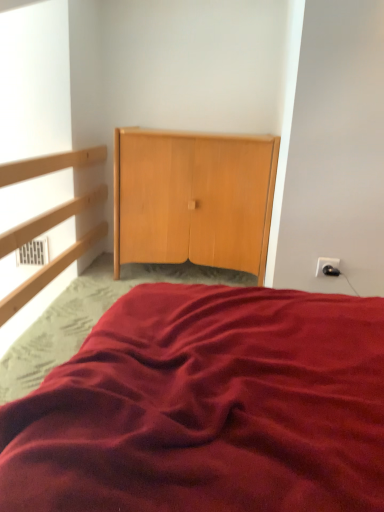
Find the location of a particular element. The image size is (384, 512). black plastic outlet at upper right is located at coordinates (327, 267).

Is burgundy satin bed at center in front of or behind black plastic outlet at upper right in the image?

Clearly, burgundy satin bed at center is in front of black plastic outlet at upper right.

Does point (147, 381) appear closer or farther from the camera than point (330, 260)?

Point (147, 381).

Is burgundy satin bed at center situated inside black plastic outlet at upper right or outside?

burgundy satin bed at center is outside black plastic outlet at upper right.

Considering the sizes of objects black plastic outlet at upper right and light wood dresser at center in the image provided, who is bigger, black plastic outlet at upper right or light wood dresser at center?

Bigger between the two is light wood dresser at center.

Is the depth of black plastic outlet at upper right less than that of light wood dresser at center?

Yes, it is.

Image resolution: width=384 pixels, height=512 pixels. In order to click on electric outlet lying below the light wood dresser at center (from the image's perspective) in this screenshot , I will do (327, 267).

Considering the positions of points (226, 140) and (328, 269), is point (226, 140) closer to camera compared to point (328, 269)?

No.

Is light wood dresser at center aimed at black plastic outlet at upper right?

No, light wood dresser at center is not oriented towards black plastic outlet at upper right.

From a real-world perspective, is light wood dresser at center physically below black plastic outlet at upper right?

Actually, light wood dresser at center is physically above black plastic outlet at upper right in the real world.

Is light wood dresser at center to the right of burgundy satin bed at center from the viewer's perspective?

In fact, light wood dresser at center is to the left of burgundy satin bed at center.

From a real-world perspective, is light wood dresser at center located higher than burgundy satin bed at center?

Indeed, from a real-world perspective, light wood dresser at center stands above burgundy satin bed at center.

Considering the relative positions of light wood dresser at center and burgundy satin bed at center in the image provided, is light wood dresser at center behind burgundy satin bed at center?

Yes, it is behind burgundy satin bed at center.

From the image's perspective, which is below, light wood dresser at center or burgundy satin bed at center?

From the image's view, burgundy satin bed at center is below.

Is black plastic outlet at upper right turned away from burgundy satin bed at center?

No, burgundy satin bed at center is not at the back of black plastic outlet at upper right.

Considering the positions of point (322, 273) and point (305, 416), is point (322, 273) closer or farther from the camera than point (305, 416)?

Point (322, 273) is farther from the camera than point (305, 416).

Which of these two, black plastic outlet at upper right or burgundy satin bed at center, stands shorter?

black plastic outlet at upper right is shorter.

Does black plastic outlet at upper right lie in front of burgundy satin bed at center?

No, it is not.

Which is closer, [228,507] or [253,181]?

The point [228,507] is in front.

Considering the relative positions of burgundy satin bed at center and light wood dresser at center in the image provided, is burgundy satin bed at center behind light wood dresser at center?

No, it is in front of light wood dresser at center.

Could you tell me if burgundy satin bed at center is turned towards light wood dresser at center?

No, burgundy satin bed at center is not oriented towards light wood dresser at center.

Which object is wider, burgundy satin bed at center or light wood dresser at center?

Wider between the two is burgundy satin bed at center.

What are the coordinates of `bed that appears on the left of black plastic outlet at upper right` in the screenshot? It's located at (207, 407).

You are a GUI agent. You are given a task and a screenshot of the screen. Output one action in this format:
    pyautogui.click(x=<x>, y=<y>)
    Task: Click on the dresser above the black plastic outlet at upper right (from the image's perspective)
    
    Given the screenshot: What is the action you would take?
    pyautogui.click(x=193, y=199)

Based on their spatial positions, is light wood dresser at center or black plastic outlet at upper right further from burgundy satin bed at center?

light wood dresser at center lies further to burgundy satin bed at center than the other object.

Looking at the image, which one is located closer to burgundy satin bed at center, black plastic outlet at upper right or light wood dresser at center?

black plastic outlet at upper right lies closer to burgundy satin bed at center than the other object.

Looking at this image, considering their positions, is burgundy satin bed at center positioned further to light wood dresser at center than black plastic outlet at upper right?

Among the two, burgundy satin bed at center is located further to light wood dresser at center.

When comparing their distances from black plastic outlet at upper right, does burgundy satin bed at center or light wood dresser at center seem further?

burgundy satin bed at center is positioned further to the anchor black plastic outlet at upper right.

Estimate the real-world distances between objects in this image. Which object is further from black plastic outlet at upper right, light wood dresser at center or burgundy satin bed at center?

burgundy satin bed at center lies further to black plastic outlet at upper right than the other object.

From the image, which object appears to be farther from light wood dresser at center, black plastic outlet at upper right or burgundy satin bed at center?

burgundy satin bed at center is positioned further to the anchor light wood dresser at center.

Find the location of a particular element. The height and width of the screenshot is (512, 384). electric outlet between burgundy satin bed at center and light wood dresser at center in the front-back direction is located at coordinates (327, 267).